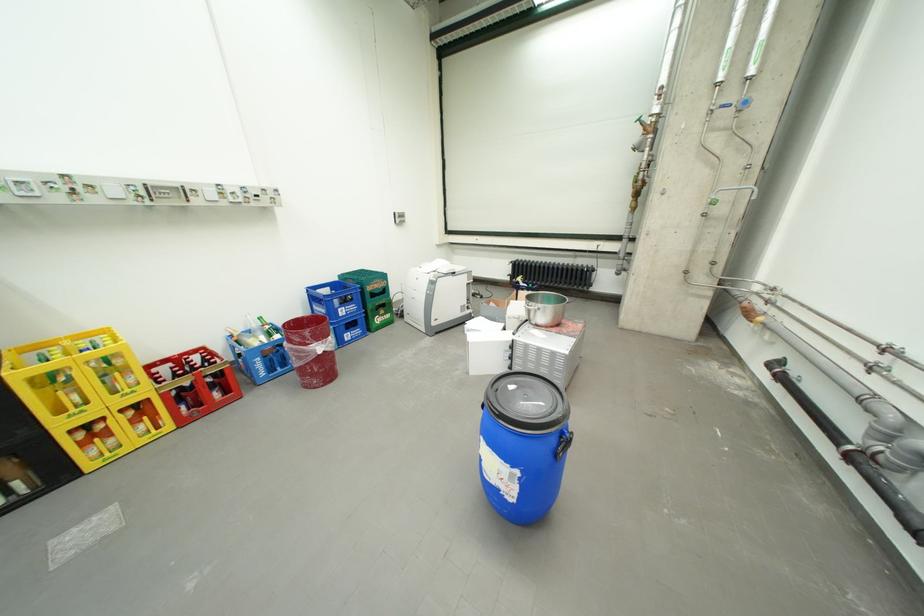
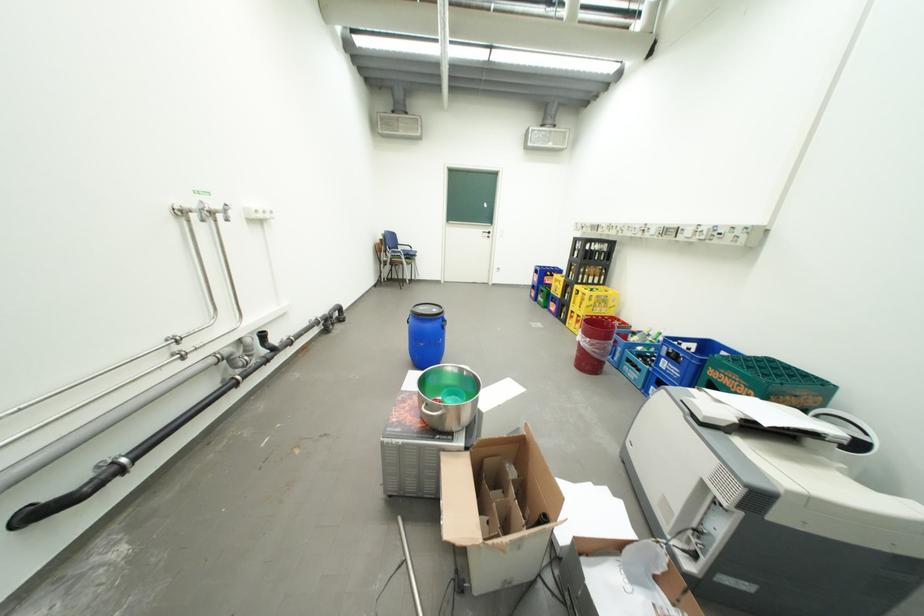
Find the pixel in the second image that matches point (393, 282) in the first image.

(756, 387)